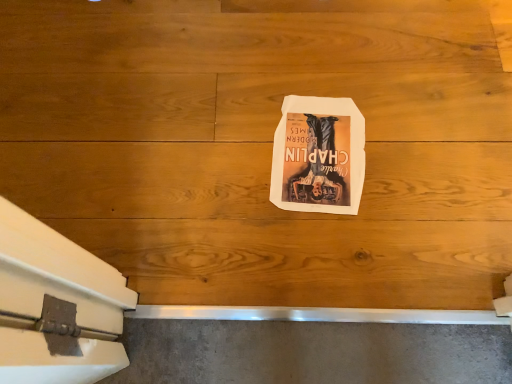
The height and width of the screenshot is (384, 512). I want to click on free space behind white paper at center, so click(297, 53).